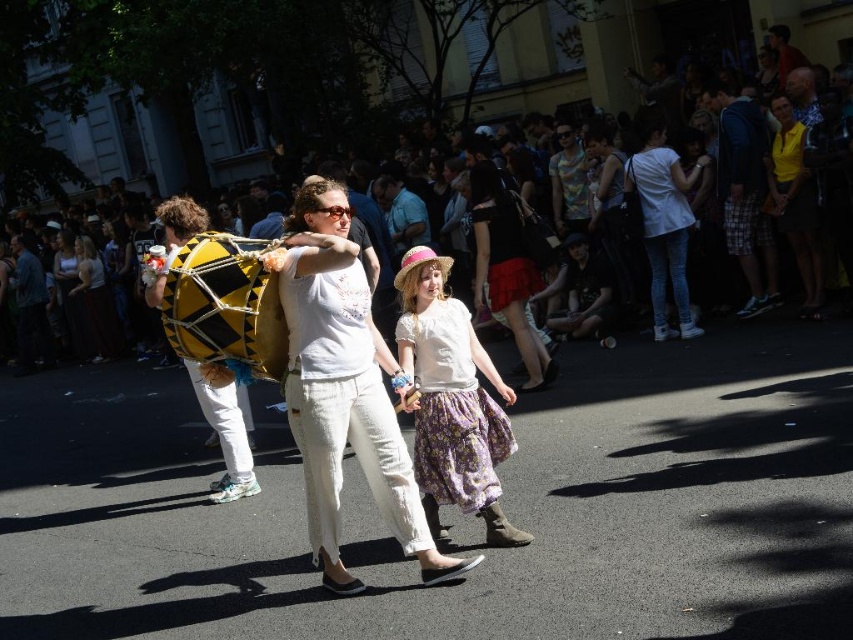
You are a photographer trying to capture the parade scene. You notice the yellow smooth shirt at upper right and want to ensure it appears in the frame. Based on its position, where should you aim your camera?

The yellow smooth shirt at upper right is located at point 0.316 on the horizontal axis and 0.933 on the vertical axis, so you should aim your camera towards the upper right area of the scene to include it in the frame.

Looking at this image, you are a photographer trying to capture both the floral cotton skirt at center and the white matte shirt at center in a single frame. Based on their sizes, which object should you focus on to ensure both fit in the photo?

The floral cotton skirt at center might be wider than the white matte shirt at center, so focusing on the wider floral cotton skirt at center would help ensure both fit in the photo.